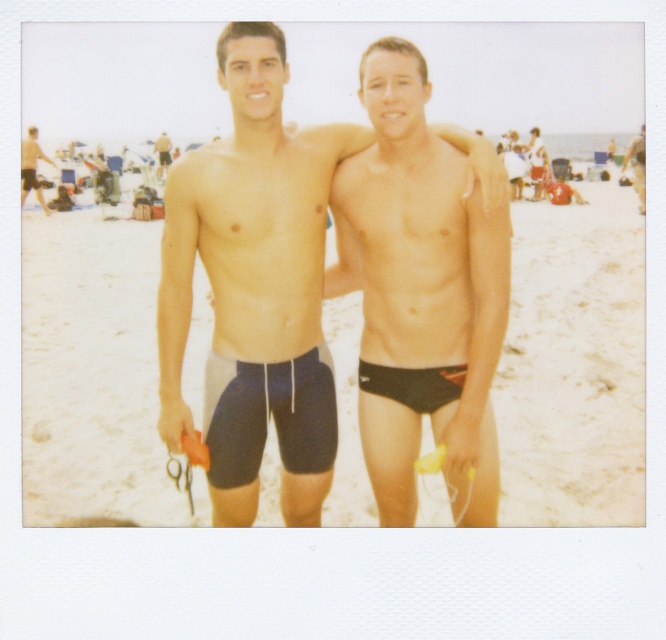
Which is behind, point (513, 145) or point (163, 145)?

Positioned behind is point (163, 145).

Can you confirm if matte black shorts at upper right is bigger than matte black shorts at center?

Indeed, matte black shorts at upper right has a larger size compared to matte black shorts at center.

What do you see at coordinates (523, 163) in the screenshot?
I see `matte black shorts at upper right` at bounding box center [523, 163].

Identify the location of matte black shorts at upper right. (523, 163).

In the scene shown: Which of these two, dark blue fabric shorts at center or black matte shorts at center, stands taller?

Standing taller between the two is black matte shorts at center.

Find the location of a particular element. This screenshot has height=640, width=666. dark blue fabric shorts at center is located at coordinates (254, 288).

Can you confirm if matte black shorts at left is shorter than black matte shorts at center?

Yes.

Who is more distant from viewer, (23, 154) or (639, 136)?

The point (639, 136) is more distant.

Locate an element on the screen. Image resolution: width=666 pixels, height=640 pixels. matte black shorts at left is located at coordinates (31, 166).